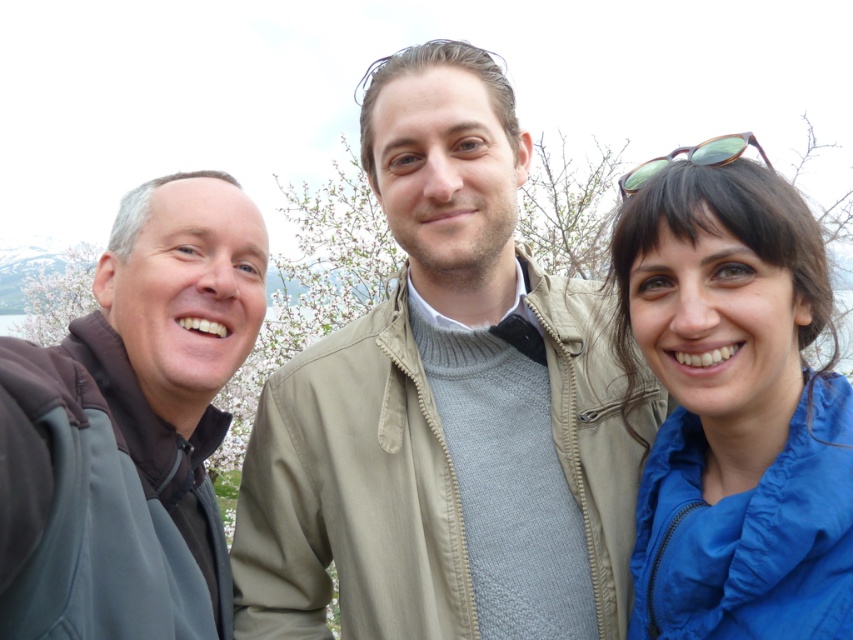
You are taking a selfie with three people in front of a scenic background. You need to place a decorative sticker exactly on the blue nylon jacket at right. According to the coordinates provided, where should you place the sticker?

The blue nylon jacket at right is located at point (734, 410), so you should place the sticker there.

You are a photographer trying to capture a group photo of the three people in the scene. You want to ensure that the blue nylon jacket at right and the dark gray fleece jacket at left are both clearly visible in the frame. Given their sizes, which jacket might require you to adjust your camera angle to avoid being overshadowed?

The blue nylon jacket at right has a smaller size compared to the dark gray fleece jacket at left, so the blue nylon jacket at right might require adjusting the camera angle to ensure it is not overshadowed by the larger jacket.

You are trying to identify the middle person in a group photo. The middle person is wearing a light beige jacket. Based on the coordinates given, can you determine if the point at (445, 406) is located on the light beige jacket at center?

The point at (445, 406) indicates the location of the light beige jacket at center, so yes, the coordinates are on the light beige jacket at center.